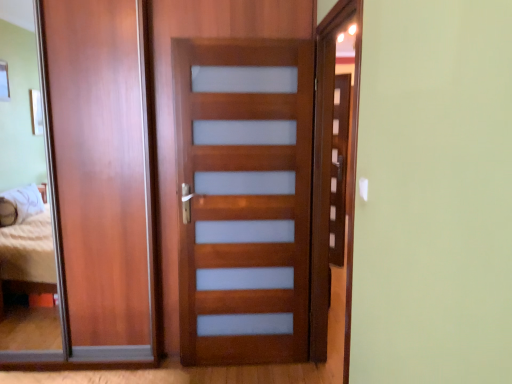
Question: Would you say matte wood barn door at left contains matte wood screen door at right, which is the 2th screen door in left-to-right order?

Choices:
 (A) yes
 (B) no

Answer: (B)

Question: Is matte wood barn door at left oriented away from matte wood screen door at right, which is the 2th screen door in left-to-right order?

Choices:
 (A) yes
 (B) no

Answer: (B)

Question: Is matte wood barn door at left smaller than matte wood screen door at right, acting as the 1th screen door starting from the right?

Choices:
 (A) yes
 (B) no

Answer: (B)

Question: Is matte wood barn door at left closer to the viewer compared to matte wood screen door at right, acting as the 1th screen door starting from the right?

Choices:
 (A) no
 (B) yes

Answer: (A)

Question: From the image's perspective, does matte wood barn door at left appear lower than matte wood screen door at right, which is the 2th screen door in left-to-right order?

Choices:
 (A) yes
 (B) no

Answer: (B)

Question: Considering the relative positions of satin wood door at center, acting as the second screen door starting from the right, and matte wood screen door at right, which is the 2th screen door in left-to-right order, in the image provided, is satin wood door at center, acting as the second screen door starting from the right, to the left or to the right of matte wood screen door at right, which is the 2th screen door in left-to-right order,?

Choices:
 (A) left
 (B) right

Answer: (A)

Question: Is satin wood door at center, acting as the second screen door starting from the right, taller or shorter than matte wood screen door at right, which is the 2th screen door in left-to-right order?

Choices:
 (A) short
 (B) tall

Answer: (A)

Question: In the image, is satin wood door at center, which is the first screen door from left to right, positioned in front of or behind matte wood screen door at right, acting as the 1th screen door starting from the right?

Choices:
 (A) front
 (B) behind

Answer: (B)

Question: From a real-world perspective, is satin wood door at center, which is the first screen door from left to right, physically located above or below matte wood screen door at right, acting as the 1th screen door starting from the right?

Choices:
 (A) above
 (B) below

Answer: (B)

Question: Is matte wood barn door at left wider or thinner than matte wood screen door at right, which is the 2th screen door in left-to-right order?

Choices:
 (A) wide
 (B) thin

Answer: (A)

Question: Is point (95, 122) positioned closer to the camera than point (326, 210)?

Choices:
 (A) farther
 (B) closer

Answer: (B)

Question: From a real-world perspective, is matte wood barn door at left physically located above or below matte wood screen door at right, acting as the 1th screen door starting from the right?

Choices:
 (A) below
 (B) above

Answer: (B)

Question: Is matte wood barn door at left spatially inside matte wood screen door at right, which is the 2th screen door in left-to-right order, or outside of it?

Choices:
 (A) inside
 (B) outside

Answer: (B)

Question: From the image's perspective, is satin wood door at center, acting as the second screen door starting from the right, located above or below matte wood barn door at left?

Choices:
 (A) below
 (B) above

Answer: (A)

Question: In terms of width, does satin wood door at center, which is the first screen door from left to right, look wider or thinner when compared to matte wood barn door at left?

Choices:
 (A) thin
 (B) wide

Answer: (B)